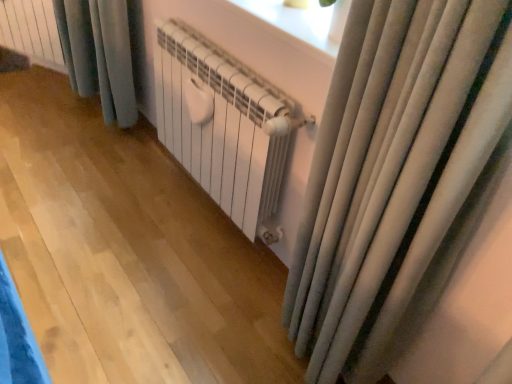
Where is `free spot below white matte radiator at upper left, which is the 2th radiator from front to back (from a real-world perspective)`? The width and height of the screenshot is (512, 384). free spot below white matte radiator at upper left, which is the 2th radiator from front to back (from a real-world perspective) is located at coordinates (39, 80).